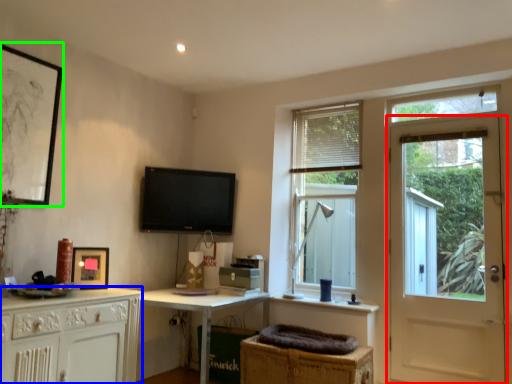
Question: Considering the real-world distances, which object is farthest from door (highlighted by a red box)? cabinetry (highlighted by a blue box) or picture frame (highlighted by a green box)?

Choices:
 (A) cabinetry
 (B) picture frame

Answer: (B)